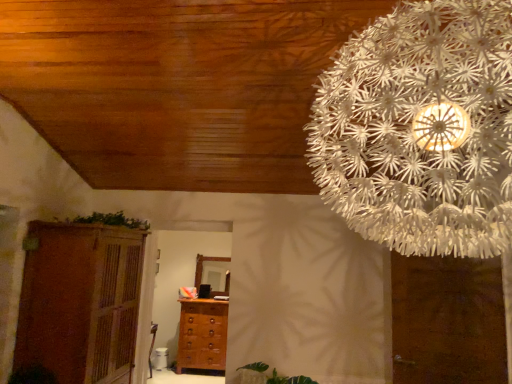
Question: Is brown matte door at upper right surrounded by brown wooden cupboard at left?

Choices:
 (A) yes
 (B) no

Answer: (B)

Question: From the image's perspective, is brown wooden cupboard at left beneath brown matte door at upper right?

Choices:
 (A) no
 (B) yes

Answer: (B)

Question: From the image's perspective, is brown wooden cupboard at left located above brown matte door at upper right?

Choices:
 (A) yes
 (B) no

Answer: (B)

Question: Can you confirm if brown wooden cupboard at left is smaller than brown matte door at upper right?

Choices:
 (A) no
 (B) yes

Answer: (A)

Question: From a real-world perspective, is brown wooden cupboard at left over brown matte door at upper right?

Choices:
 (A) yes
 (B) no

Answer: (B)

Question: Looking at the image, does green leafy plant at upper left seem bigger or smaller compared to white paper flower at upper right?

Choices:
 (A) big
 (B) small

Answer: (B)

Question: Would you say green leafy plant at upper left is to the left or to the right of white paper flower at upper right in the picture?

Choices:
 (A) right
 (B) left

Answer: (B)

Question: Is green leafy plant at upper left in front of or behind white paper flower at upper right in the image?

Choices:
 (A) front
 (B) behind

Answer: (B)

Question: Is green leafy plant at upper left taller or shorter than white paper flower at upper right?

Choices:
 (A) short
 (B) tall

Answer: (A)

Question: In terms of height, does brown wooden cupboard at left look taller or shorter compared to brown wooden chest of drawers at center?

Choices:
 (A) tall
 (B) short

Answer: (A)

Question: From the image's perspective, relative to brown wooden chest of drawers at center, is brown wooden cupboard at left above or below?

Choices:
 (A) below
 (B) above

Answer: (B)

Question: Would you say brown wooden cupboard at left is inside or outside brown wooden chest of drawers at center?

Choices:
 (A) outside
 (B) inside

Answer: (A)

Question: Is brown wooden cupboard at left wider or thinner than brown wooden chest of drawers at center?

Choices:
 (A) wide
 (B) thin

Answer: (A)

Question: Is brown matte door at upper right inside or outside of green leafy plant at upper left?

Choices:
 (A) inside
 (B) outside

Answer: (B)

Question: In terms of width, does brown matte door at upper right look wider or thinner when compared to green leafy plant at upper left?

Choices:
 (A) thin
 (B) wide

Answer: (A)